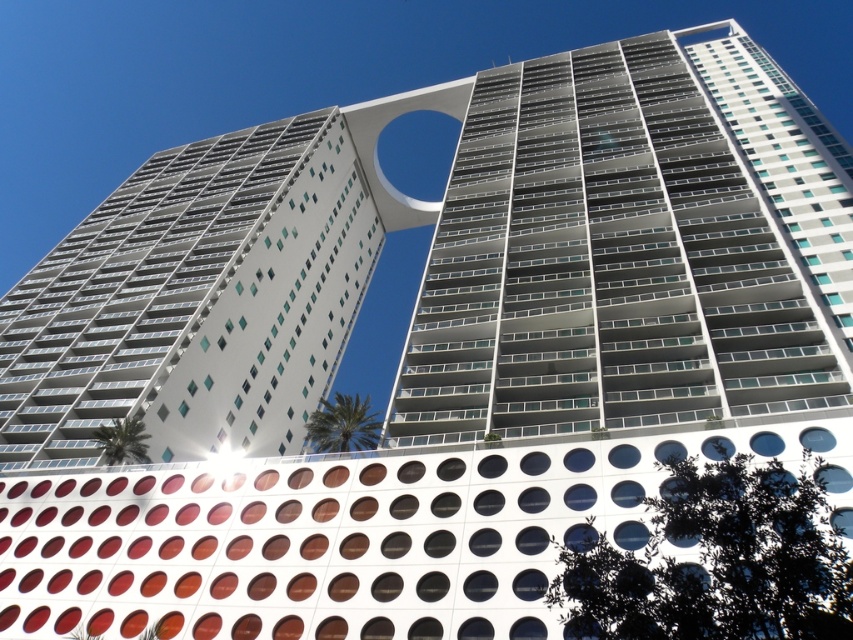
Which of these two, metallic glass building at center or white glass building at center, stands taller?

metallic glass building at center is taller.

Who is shorter, metallic glass building at center or white glass building at center?

white glass building at center is shorter.

What are the coordinates of `metallic glass building at center` in the screenshot? It's located at (631, 248).

Where is `metallic glass building at center`? The width and height of the screenshot is (853, 640). metallic glass building at center is located at coordinates coord(631,248).